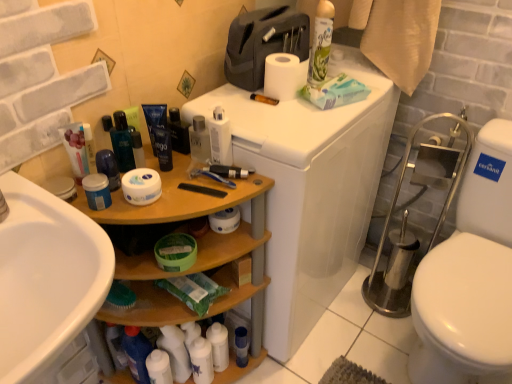
The width and height of the screenshot is (512, 384). What are the coordinates of `free region on the left part of white glossy toilet paper at upper right` in the screenshot? It's located at (268, 111).